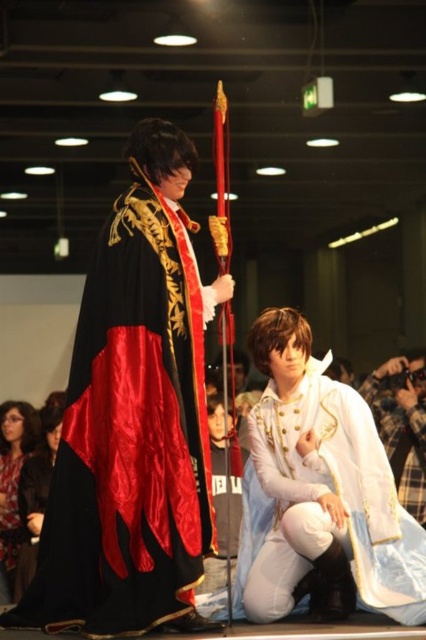
Question: Which object is closer to the camera taking this photo?

Choices:
 (A) satin black dress at lower left
 (B) satin/black cape at center

Answer: (B)

Question: Which point appears farthest from the camera in this image?

Choices:
 (A) (0, 531)
 (B) (383, 412)
 (C) (256, 424)
 (D) (39, 465)

Answer: (B)

Question: Can you confirm if white satin dress at lower right is thinner than matte black hair at lower left?

Choices:
 (A) no
 (B) yes

Answer: (A)

Question: Is the position of white satin coat at lower right less distant than that of white satin dress at lower right?

Choices:
 (A) yes
 (B) no

Answer: (A)

Question: Which point is farther from the camera taking this photo?

Choices:
 (A) (104, 595)
 (B) (270, 401)
 (C) (368, 400)

Answer: (C)

Question: Considering the relative positions of satin/black cape at center and white satin coat at lower right in the image provided, where is satin/black cape at center located with respect to white satin coat at lower right?

Choices:
 (A) right
 (B) left

Answer: (B)